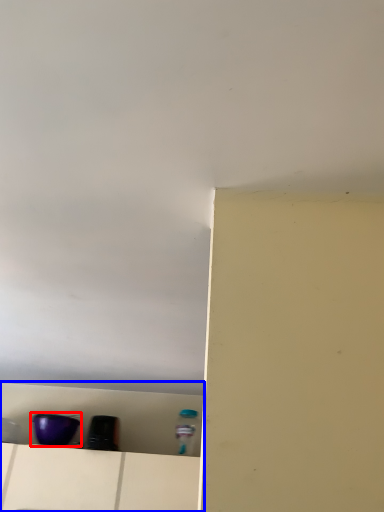
Question: Which object is further to the camera taking this photo, appliance (highlighted by a red box) or shelf (highlighted by a blue box)?

Choices:
 (A) appliance
 (B) shelf

Answer: (A)